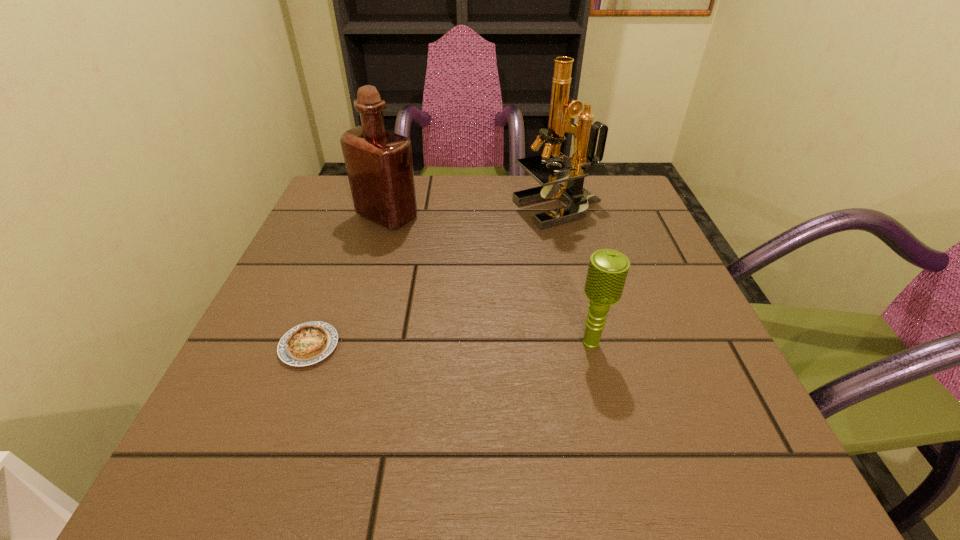
You are a GUI agent. You are given a task and a screenshot of the screen. Output one action in this format:
    pyautogui.click(x=<x>, y=<y>)
    Task: Click on the free space between the microscope and the liquor
    This screenshot has width=960, height=540.
    Given the screenshot: What is the action you would take?
    pyautogui.click(x=473, y=213)

The height and width of the screenshot is (540, 960). Find the location of `empty space between the shortest object and the microphone`. empty space between the shortest object and the microphone is located at coordinates (450, 345).

Identify which object is the second nearest to the microphone. Please provide its 2D coordinates. Your answer should be formatted as a tuple, i.e. [(x, y)], where the tuple contains the x and y coordinates of a point satisfying the conditions above.

[(308, 343)]

I want to click on the second closest object to the microphone, so click(x=308, y=343).

Find the location of `vacant space that satisfies the following two spatial constraints: 1. on the front side of the microphone; 2. on the left side of the third shortest object`. vacant space that satisfies the following two spatial constraints: 1. on the front side of the microphone; 2. on the left side of the third shortest object is located at coordinates (350, 344).